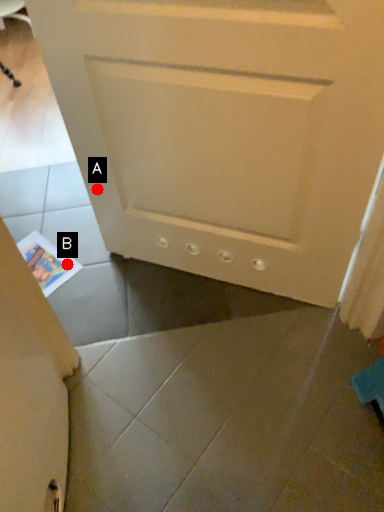
Question: Two points are circled on the image, labeled by A and B beside each circle. Which point is further to the camera?

Choices:
 (A) A is further
 (B) B is further

Answer: (B)